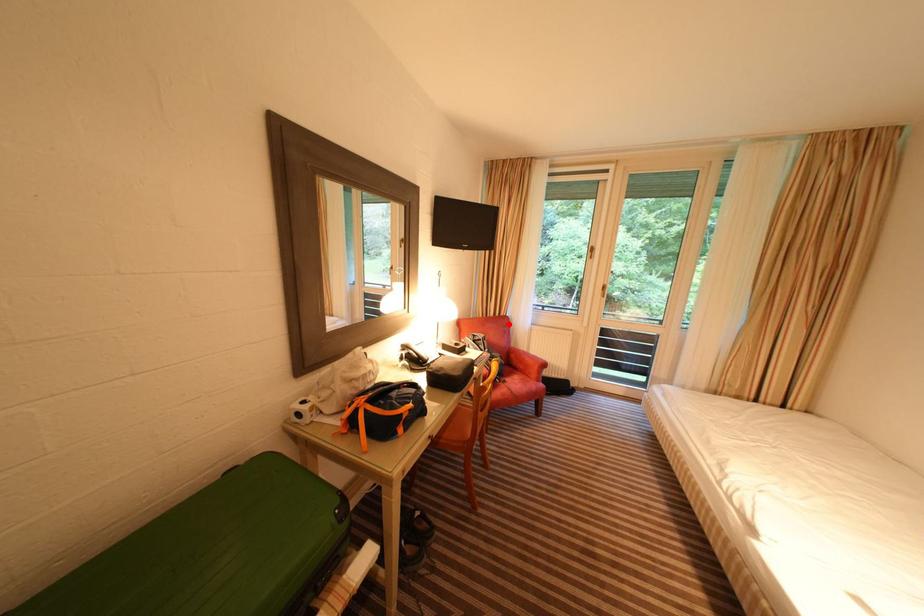
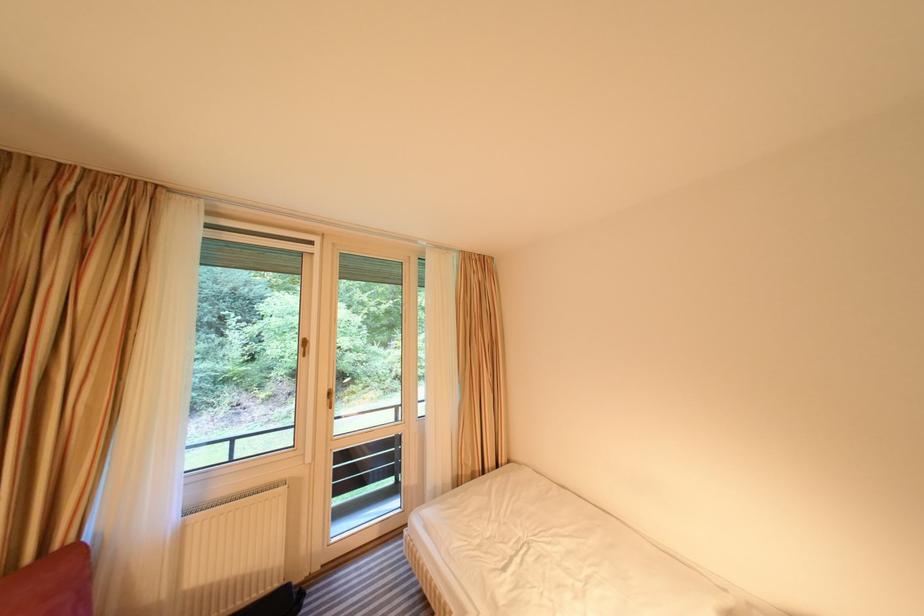
The point at the highlighted location is marked in the first image. Where is the corresponding point in the second image?

(57, 578)